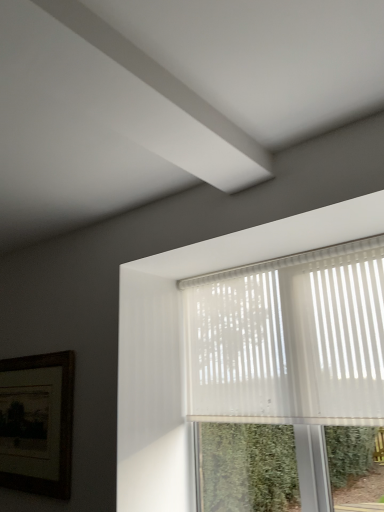
Describe the element at coordinates (290, 346) in the screenshot. I see `translucent plastic window at upper right` at that location.

Where is `translucent plastic window at upper right`? translucent plastic window at upper right is located at coordinates (290, 346).

Describe the element at coordinates (41, 425) in the screenshot. The width and height of the screenshot is (384, 512). I see `wooden framed picture at lower left` at that location.

Where is `wooden framed picture at lower left`? wooden framed picture at lower left is located at coordinates (41, 425).

This screenshot has height=512, width=384. Find the location of `translucent plastic window at upper right`. translucent plastic window at upper right is located at coordinates (290, 346).

Which object is positioned more to the right, wooden framed picture at lower left or translucent plastic window at upper right?

Positioned to the right is translucent plastic window at upper right.

Consider the image. Who is more distant, wooden framed picture at lower left or translucent plastic window at upper right?

wooden framed picture at lower left is further away from the camera.

Is point (23, 372) more distant than point (259, 301)?

That is True.

From the image's perspective, relative to translucent plastic window at upper right, is wooden framed picture at lower left above or below?

wooden framed picture at lower left is situated lower than translucent plastic window at upper right in the image.

From a real-world perspective, which is physically below, wooden framed picture at lower left or translucent plastic window at upper right?

wooden framed picture at lower left.

Which object is wider, wooden framed picture at lower left or translucent plastic window at upper right?

translucent plastic window at upper right.

Can you confirm if wooden framed picture at lower left is shorter than translucent plastic window at upper right?

Correct, wooden framed picture at lower left is not as tall as translucent plastic window at upper right.

Can you confirm if wooden framed picture at lower left is bigger than translucent plastic window at upper right?

Actually, wooden framed picture at lower left might be smaller than translucent plastic window at upper right.

Is wooden framed picture at lower left spatially inside translucent plastic window at upper right, or outside of it?

wooden framed picture at lower left cannot be found inside translucent plastic window at upper right.

Is wooden framed picture at lower left positioned far away from translucent plastic window at upper right?

They are positioned close to each other.

Is wooden framed picture at lower left oriented away from translucent plastic window at upper right?

No, wooden framed picture at lower left is not facing the opposite direction of translucent plastic window at upper right.

How many degrees apart are the facing directions of wooden framed picture at lower left and translucent plastic window at upper right?

There is a 0.269-degree angle between the facing directions of wooden framed picture at lower left and translucent plastic window at upper right.

Measure the distance between wooden framed picture at lower left and translucent plastic window at upper right.

wooden framed picture at lower left is 32.95 inches from translucent plastic window at upper right.

At what (x,y) coordinates should I click in order to perform the action: click on picture frame below the translucent plastic window at upper right (from the image's perspective). Please return your answer as a coordinate pair (x, y). Looking at the image, I should click on pyautogui.click(x=41, y=425).

Which is more to the right, translucent plastic window at upper right or wooden framed picture at lower left?

translucent plastic window at upper right is more to the right.

Considering the positions of objects translucent plastic window at upper right and wooden framed picture at lower left in the image provided, who is behind, translucent plastic window at upper right or wooden framed picture at lower left?

Positioned behind is wooden framed picture at lower left.

Is point (352, 323) in front of point (48, 378)?

That is True.

From the image's perspective, is translucent plastic window at upper right on top of wooden framed picture at lower left?

Answer: Yes.

From a real-world perspective, which object rests below the other?

In real-world perspective, wooden framed picture at lower left is lower.

Considering the relative sizes of translucent plastic window at upper right and wooden framed picture at lower left in the image provided, is translucent plastic window at upper right wider than wooden framed picture at lower left?

Correct, the width of translucent plastic window at upper right exceeds that of wooden framed picture at lower left.

Can you confirm if translucent plastic window at upper right is taller than wooden framed picture at lower left?

Correct, translucent plastic window at upper right is much taller as wooden framed picture at lower left.

Does translucent plastic window at upper right have a smaller size compared to wooden framed picture at lower left?

No, translucent plastic window at upper right is not smaller than wooden framed picture at lower left.

Is translucent plastic window at upper right inside the boundaries of wooden framed picture at lower left, or outside?

translucent plastic window at upper right cannot be found inside wooden framed picture at lower left.

Are translucent plastic window at upper right and wooden framed picture at lower left far apart?

→ translucent plastic window at upper right is near wooden framed picture at lower left, not far away.

Does translucent plastic window at upper right turn towards wooden framed picture at lower left?

No, translucent plastic window at upper right does not turn towards wooden framed picture at lower left.

What's the angular difference between translucent plastic window at upper right and wooden framed picture at lower left's facing directions?

The facing directions of translucent plastic window at upper right and wooden framed picture at lower left are 0.269 degrees apart.

The height and width of the screenshot is (512, 384). In order to click on picture frame below the translucent plastic window at upper right (from the image's perspective) in this screenshot , I will do `click(41, 425)`.

The width and height of the screenshot is (384, 512). What are the coordinates of `picture frame below the translucent plastic window at upper right (from the image's perspective)` in the screenshot? It's located at (41, 425).

Locate an element on the screen. picture frame that is behind the translucent plastic window at upper right is located at coordinates (41, 425).